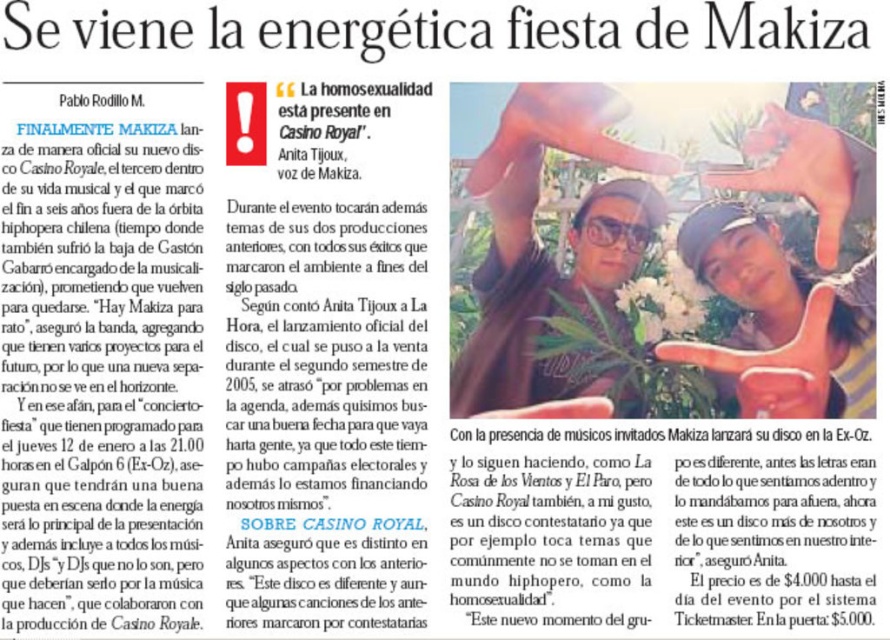
Is matte black cap at upper right above matte black sunglasses at center?

Yes.

Is point (779, 296) less distant than point (506, 243)?

Yes, it is in front of point (506, 243).

I want to click on matte black cap at upper right, so click(x=779, y=321).